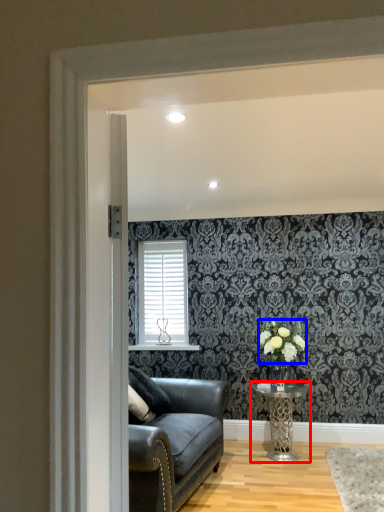
Question: Which point is further to the camera, table (highlighted by a red box) or flower (highlighted by a blue box)?

Choices:
 (A) table
 (B) flower

Answer: (B)